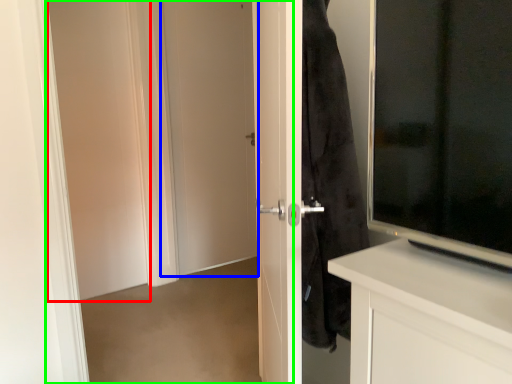
Question: Based on their relative distances, which object is nearer to screen door (highlighted by a red box)? Choose from door (highlighted by a blue box) and screen door (highlighted by a green box).

Choices:
 (A) door
 (B) screen door

Answer: (B)